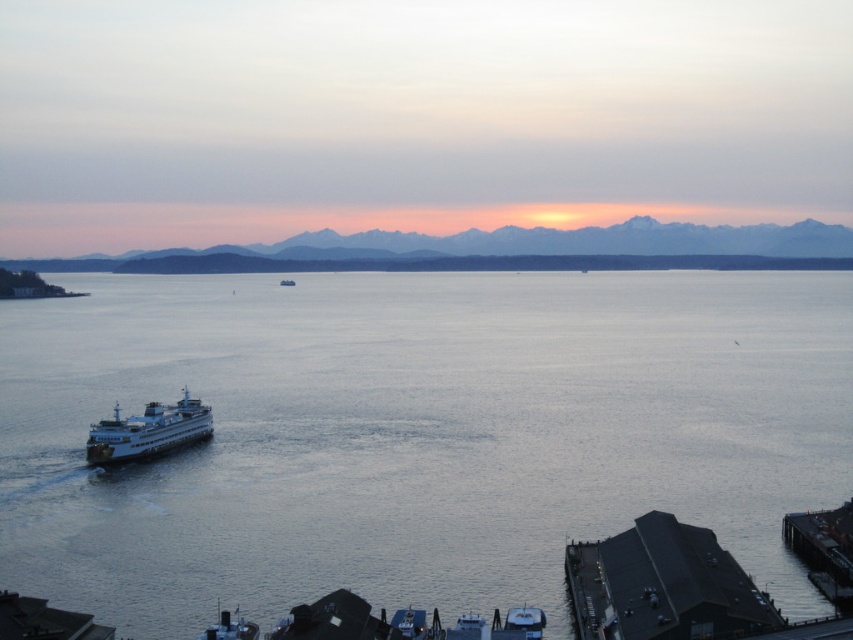
Question: Where is gray water at center located in relation to white glossy ferry at lower left in the image?

Choices:
 (A) right
 (B) left

Answer: (A)

Question: Is gray water at center positioned at the back of white glossy ferry at lower left?

Choices:
 (A) yes
 (B) no

Answer: (B)

Question: Which point is farther from the camera taking this photo?

Choices:
 (A) (660, 385)
 (B) (169, 406)

Answer: (A)

Question: Is gray water at center wider than white glossy ferry at lower left?

Choices:
 (A) no
 (B) yes

Answer: (B)